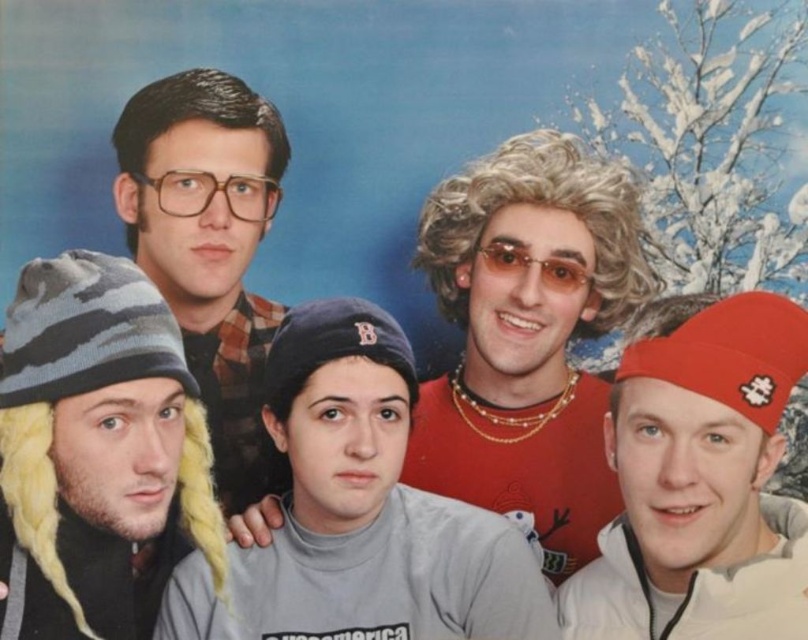
Is point (574, 602) farther from camera compared to point (150, 163)?

No.

Is red matte cap at lower right positioned at the back of matte black glasses at upper left?

No, red matte cap at lower right is in front of matte black glasses at upper left.

Does point (745, 376) come behind point (209, 72)?

No, (745, 376) is closer to viewer.

Locate an element on the screen. The width and height of the screenshot is (808, 640). red matte cap at lower right is located at coordinates (701, 484).

Which is more to the right, shiny gold necklace at center or matte black glasses at upper left?

Positioned to the right is shiny gold necklace at center.

Does shiny gold necklace at center have a lesser height compared to matte black glasses at upper left?

Yes.

Is point (608, 513) positioned after point (247, 212)?

That is False.

Where is `shiny gold necklace at center`? shiny gold necklace at center is located at coordinates (527, 337).

Consider the image. Is gray matte t-shirt at center positioned before red matte cap at lower right?

No.

The image size is (808, 640). Describe the element at coordinates (360, 513) in the screenshot. I see `gray matte t-shirt at center` at that location.

This screenshot has height=640, width=808. What are the coordinates of `gray matte t-shirt at center` in the screenshot? It's located at (360, 513).